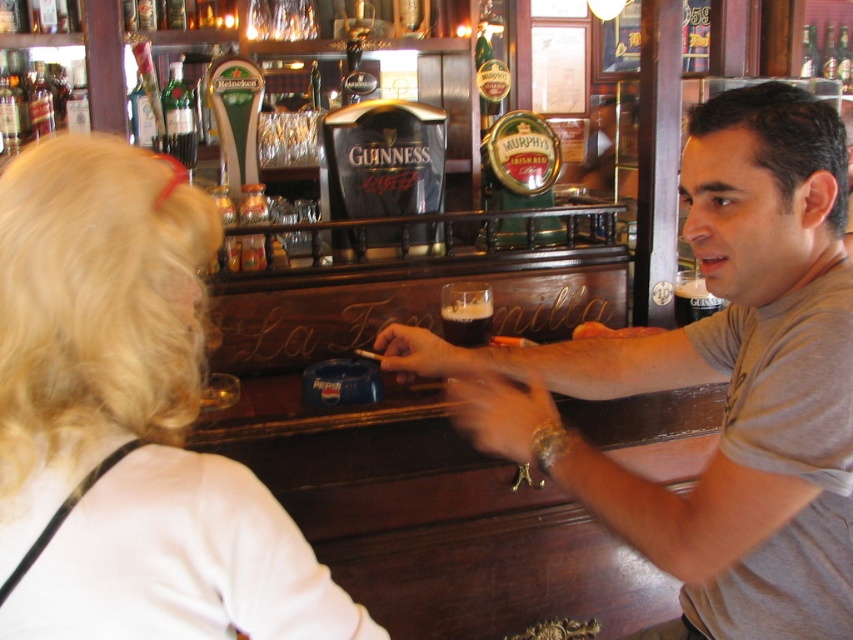
You are a photographer taking a portrait of the woman with blonde hair at upper left and the dark matte glass at center. Which object appears wider in the photo?

The blonde hair at upper left appears wider in the photo because its width is larger than the dark matte glass at center.

You are a bartender at La Tavola and need to reach the dark matte glass at center to serve a customer. However, there is a customer with blonde hair at upper left blocking your path. From your position behind the bar counter, can you move around them to access the glass?

The blonde hair at upper left is to the left of the dark matte glass at center, so the customer with blonde hair is blocking the path to the glass. You will need to move around them from the right side to access the dark matte glass at center without obstruction.